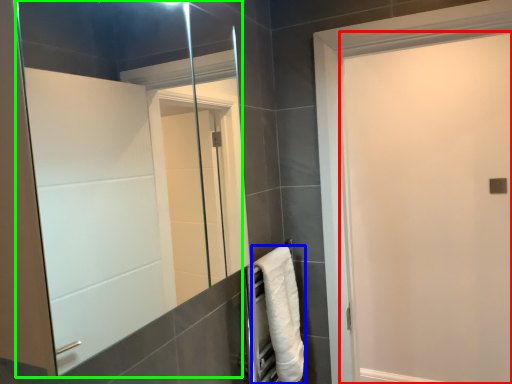
Question: Based on their relative distances, which object is nearer to screen door (highlighted by a red box)? Choose from towel (highlighted by a blue box) and mirror (highlighted by a green box).

Choices:
 (A) towel
 (B) mirror

Answer: (B)